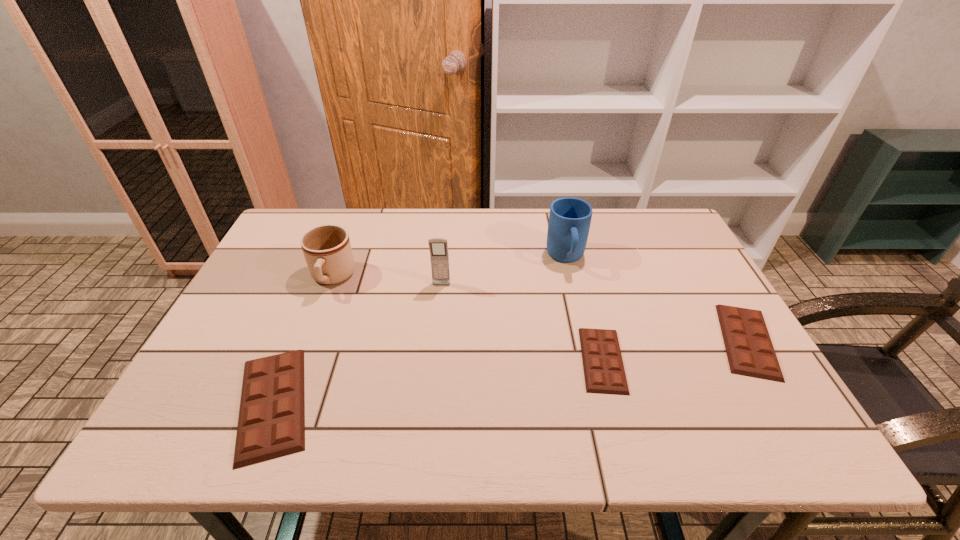
Identify the location of vacant space that satisfies the following two spatial constraints: 1. on the side of the rightmost object with the handle; 2. on the right side of the third tallest object. Image resolution: width=960 pixels, height=540 pixels. (308, 341).

What are the coordinates of `vacant space that satisfies the following two spatial constraints: 1. on the side of the shortest object with the handle; 2. on the left side of the third tallest object` in the screenshot? It's located at (300, 360).